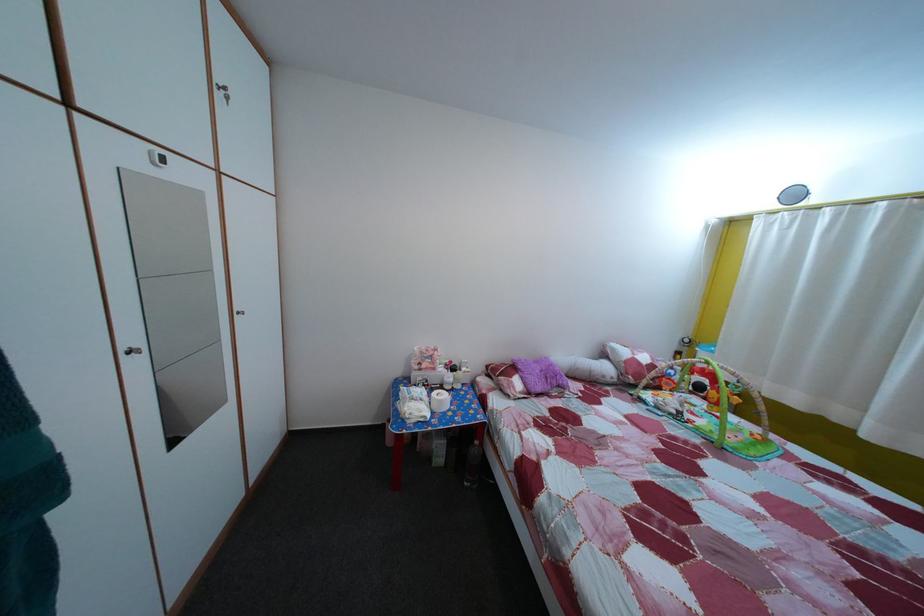
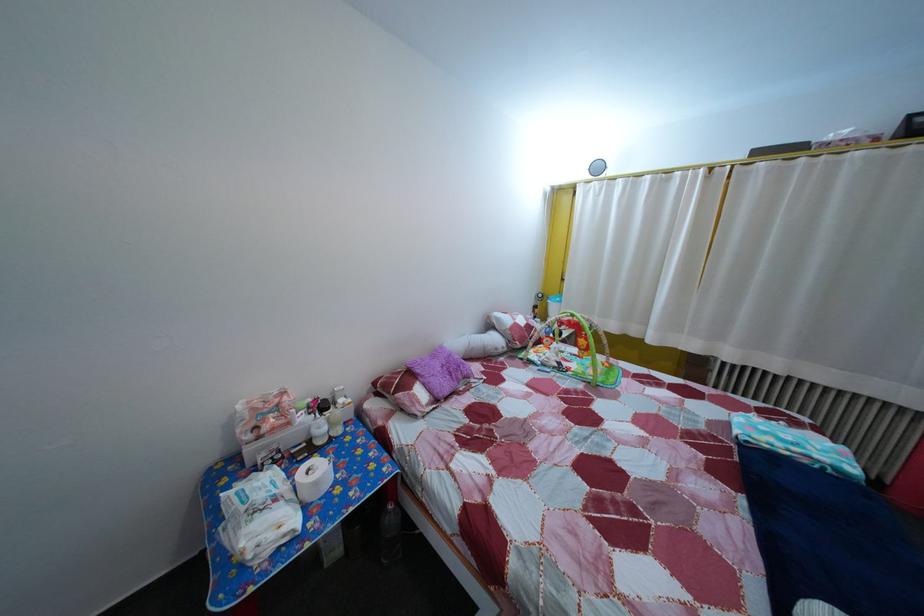
Where in the second image is the point corresponding to the point at 684,419 from the first image?

(565, 371)